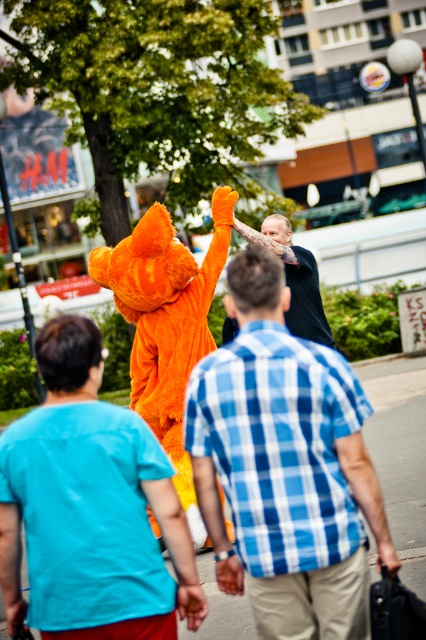
Looking at this image, you are a photographer trying to capture a photo of the black textured shirt at center without the orange plush costume at center blocking it. Which object should you move closer to in order to avoid the obstruction?

The orange plush costume at center is taller than the black textured shirt at center. To avoid the obstruction, you should move closer to the black textured shirt at center so that the orange plush costume at center no longer blocks the view.

You are a photographer trying to capture the entire orange plush costume at center and fuzzy orange costume at center in one frame. Based on their sizes, which costume should you focus on to ensure both fit in the photo?

Since the orange plush costume at center occupies less space than the fuzzy orange costume at center, you should focus on the fuzzy orange costume at center as it takes up more space, allowing both to fit in the frame.